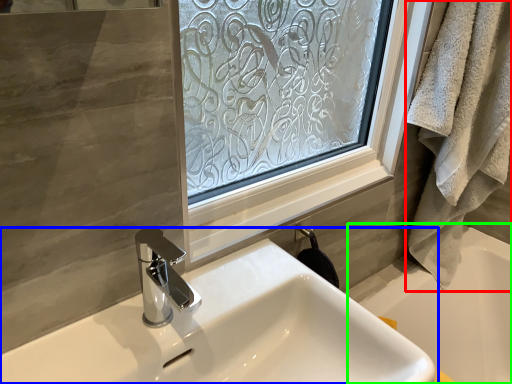
Question: Based on their relative distances, which object is nearer to bath towel (highlighted by a red box)? Choose from sink (highlighted by a blue box) and bath (highlighted by a green box).

Choices:
 (A) sink
 (B) bath

Answer: (B)